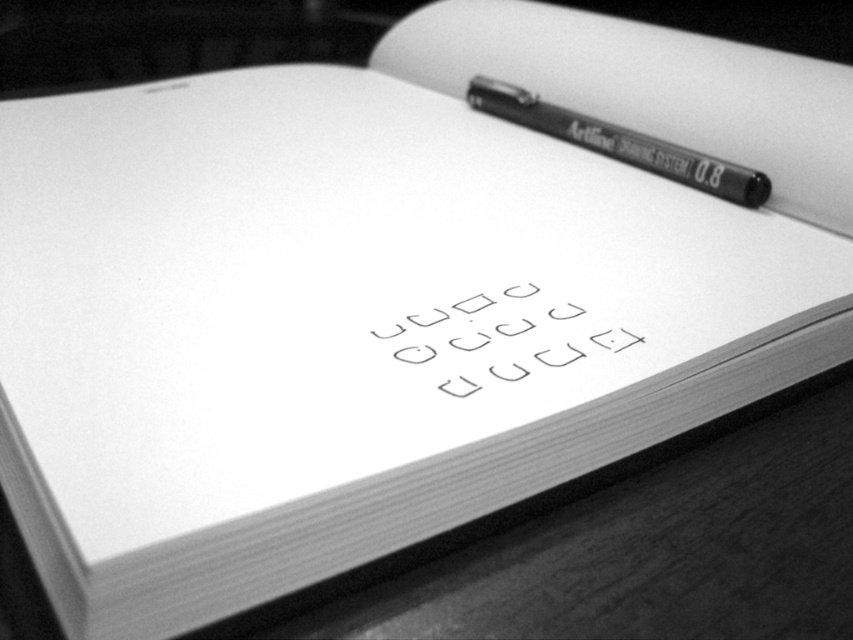
Question: Which point is farther from the camera taking this photo?

Choices:
 (A) click(498, 349)
 (B) click(549, 132)

Answer: (B)

Question: Does white paper at center appear under black matte pen at upper right?

Choices:
 (A) no
 (B) yes

Answer: (B)

Question: Observing the image, what is the correct spatial positioning of white paper at center in reference to black matte pen at upper right?

Choices:
 (A) below
 (B) above

Answer: (A)

Question: Is white paper at center behind black matte pen at upper right?

Choices:
 (A) yes
 (B) no

Answer: (B)

Question: Among these objects, which one is farthest from the camera?

Choices:
 (A) black matte pen at upper right
 (B) white paper at center

Answer: (A)